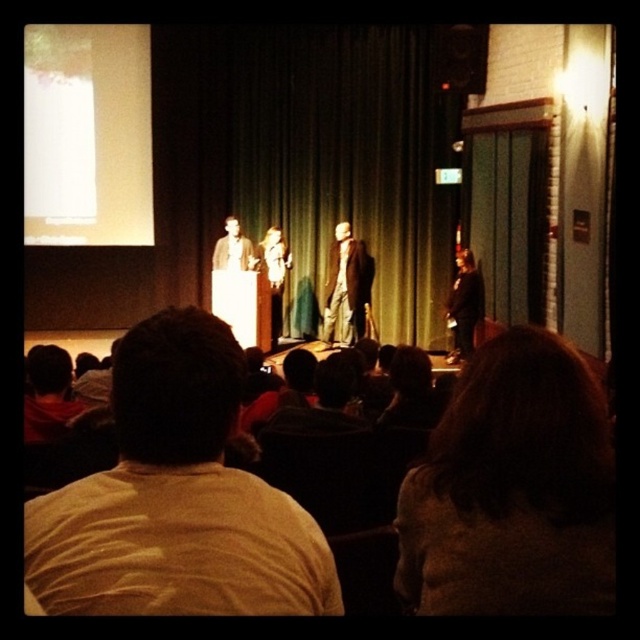
You are sitting in the audience and want to know who is taller between the dark brown hair at center and the matte brown suit at center. Can you determine this based on their positions?

The dark brown hair at center is not as tall as the matte brown suit at center, so the matte brown suit at center is taller.

You are sitting in the front row of the auditorium and notice two people at the center of the stage. One has dark brown hair at center and the other is wearing a matte brown suit at center. If you want to wave to both of them simultaneously, which one would you need to wave toward first as you move your hand from left to right?

Since the dark brown hair at center is 28.92 feet away from the matte brown suit at center, you would first wave toward the dark brown hair at center before moving your hand toward the matte brown suit at center as you move from left to right.

You are standing at point (362, 32) and want to walk to the stage. Is there enough space to move forward without obstacles?

The distance between you and the stage is 10.32 meters, so there is sufficient space to move forward without obstacles.